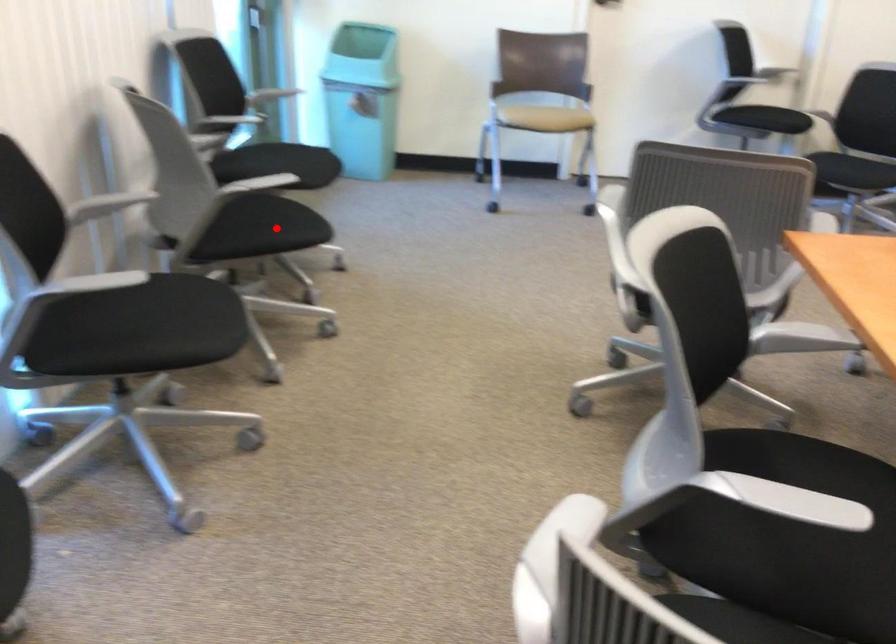
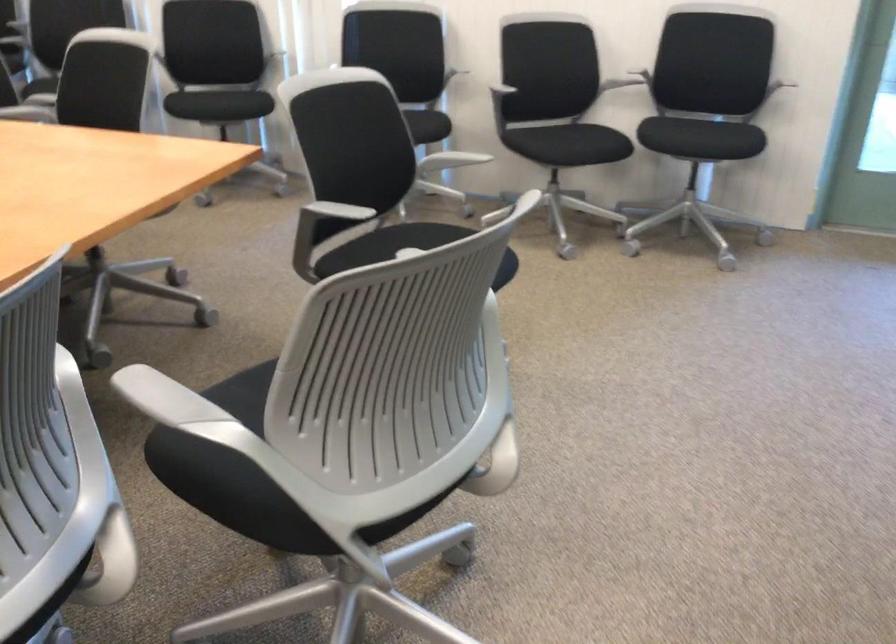
Question: A red point is marked in image1. In image2, is the corresponding 3D point closer to the camera or farther? Reply with the corresponding letter.

Choices:
 (A) The corresponding 3D point is closer.
 (B) The corresponding 3D point is farther.

Answer: (B)